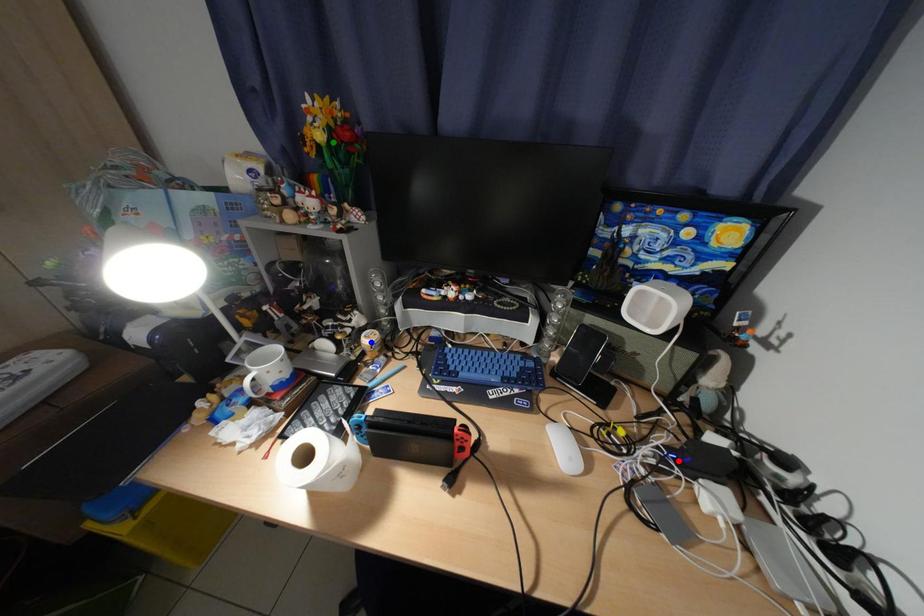
Order these from nearest to farthest:
green point | blue point | red point

red point
green point
blue point